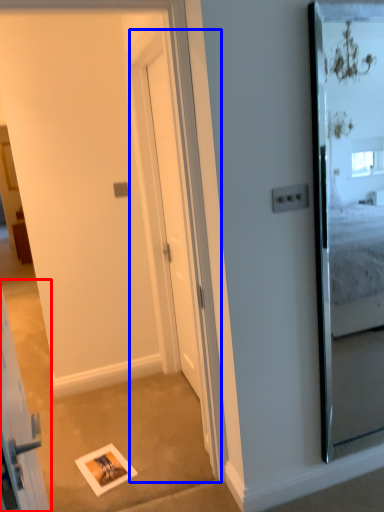
Question: Among these objects, which one is farthest to the camera, elevator (highlighted by a red box) or screen door (highlighted by a blue box)?

Choices:
 (A) elevator
 (B) screen door

Answer: (B)